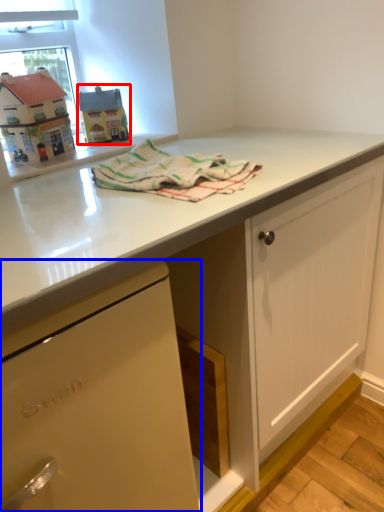
Question: Which of the following is the closest to the observer, appliance (highlighted by a red box) or cabinetry (highlighted by a blue box)?

Choices:
 (A) appliance
 (B) cabinetry

Answer: (B)